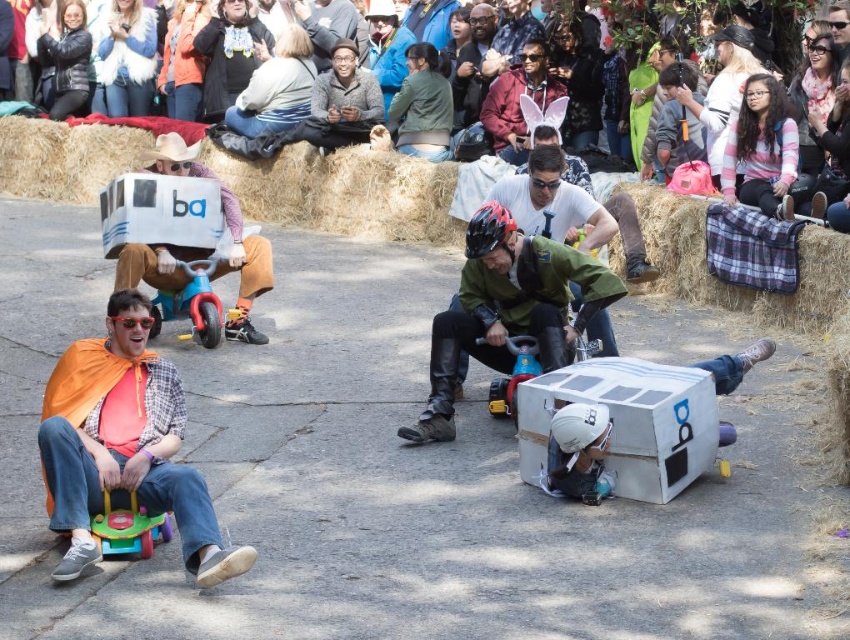
Question: Does matte cardboard box at center come in front of white cardboard box at left?

Choices:
 (A) no
 (B) yes

Answer: (B)

Question: Among these points, which one is farthest from the camera?

Choices:
 (A) (244, 164)
 (B) (437, 337)
 (C) (47, 128)
 (D) (177, 305)

Answer: (C)

Question: Does matte plastic tricycle at center have a lesser width compared to matte plastic toy car at center?

Choices:
 (A) yes
 (B) no

Answer: (B)

Question: Which of the following is the closest to the observer?

Choices:
 (A) matte plastic toy car at center
 (B) orange fabric cape at left
 (C) matte plastic tricycle at center

Answer: (B)

Question: Which of the following is the closest to the observer?

Choices:
 (A) matte pink bunny ears at center
 (B) plaid fabric at upper right
 (C) white cardboard box at upper center
 (D) wooden toy at lower left

Answer: (D)

Question: Can you confirm if orange fabric cape at left is positioned above matte plastic toy car at center?

Choices:
 (A) no
 (B) yes

Answer: (A)